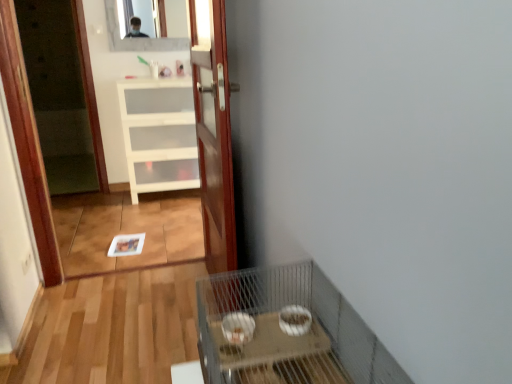
Question: Does metal wire cage at lower right have a greater height compared to clear glass mirror at upper center?

Choices:
 (A) no
 (B) yes

Answer: (A)

Question: Is metal wire cage at lower right smaller than clear glass mirror at upper center?

Choices:
 (A) no
 (B) yes

Answer: (A)

Question: Is clear glass mirror at upper center at the back of metal wire cage at lower right?

Choices:
 (A) no
 (B) yes

Answer: (A)

Question: Is metal wire cage at lower right not close to clear glass mirror at upper center?

Choices:
 (A) yes
 (B) no

Answer: (A)

Question: Is metal wire cage at lower right to the left of clear glass mirror at upper center from the viewer's perspective?

Choices:
 (A) no
 (B) yes

Answer: (A)

Question: Considering the positions of wooden door at center and white matte cabinet at center in the image, is wooden door at center taller or shorter than white matte cabinet at center?

Choices:
 (A) short
 (B) tall

Answer: (B)

Question: Looking at the image, does wooden door at center seem bigger or smaller compared to white matte cabinet at center?

Choices:
 (A) big
 (B) small

Answer: (B)

Question: Considering their positions, is wooden door at center located in front of or behind white matte cabinet at center?

Choices:
 (A) front
 (B) behind

Answer: (A)

Question: In terms of width, does wooden door at center look wider or thinner when compared to white matte cabinet at center?

Choices:
 (A) thin
 (B) wide

Answer: (A)

Question: Do you think metal wire cage at lower right is within clear glass mirror at upper center, or outside of it?

Choices:
 (A) outside
 (B) inside

Answer: (A)

Question: Is metal wire cage at lower right taller or shorter than clear glass mirror at upper center?

Choices:
 (A) tall
 (B) short

Answer: (B)

Question: From a real-world perspective, relative to clear glass mirror at upper center, is metal wire cage at lower right vertically above or below?

Choices:
 (A) above
 (B) below

Answer: (B)

Question: In the image, is metal wire cage at lower right on the left side or the right side of clear glass mirror at upper center?

Choices:
 (A) right
 (B) left

Answer: (A)

Question: Based on their positions, is wooden door at center located to the left or right of clear glass mirror at upper center?

Choices:
 (A) right
 (B) left

Answer: (A)

Question: Would you say wooden door at center is inside or outside clear glass mirror at upper center?

Choices:
 (A) outside
 (B) inside

Answer: (A)